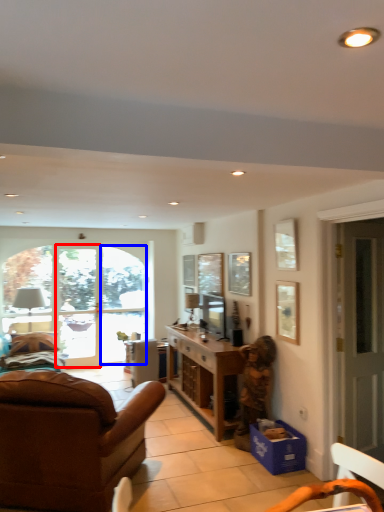
Question: Which of the following is the farthest to the observer, glass door (highlighted by a red box) or window (highlighted by a blue box)?

Choices:
 (A) glass door
 (B) window

Answer: (B)